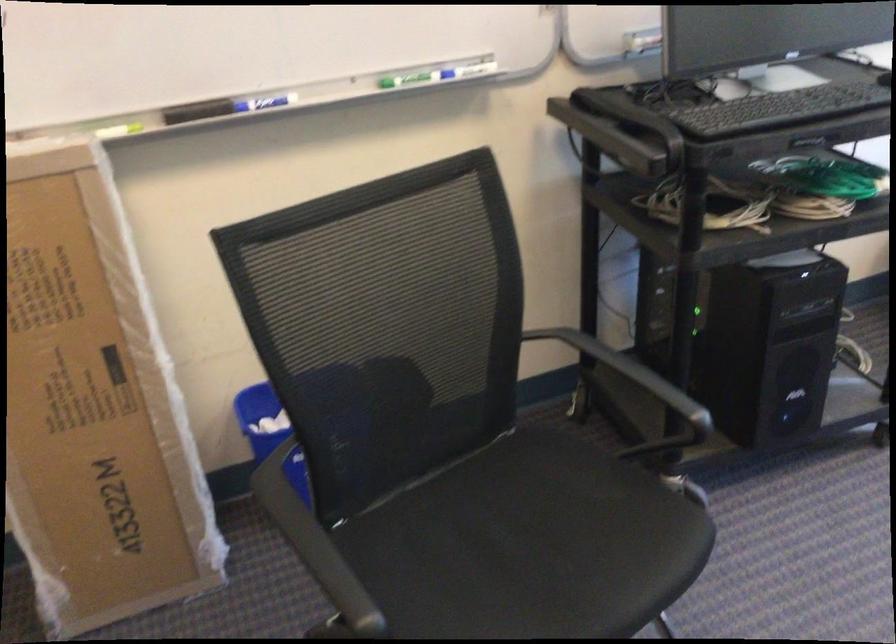
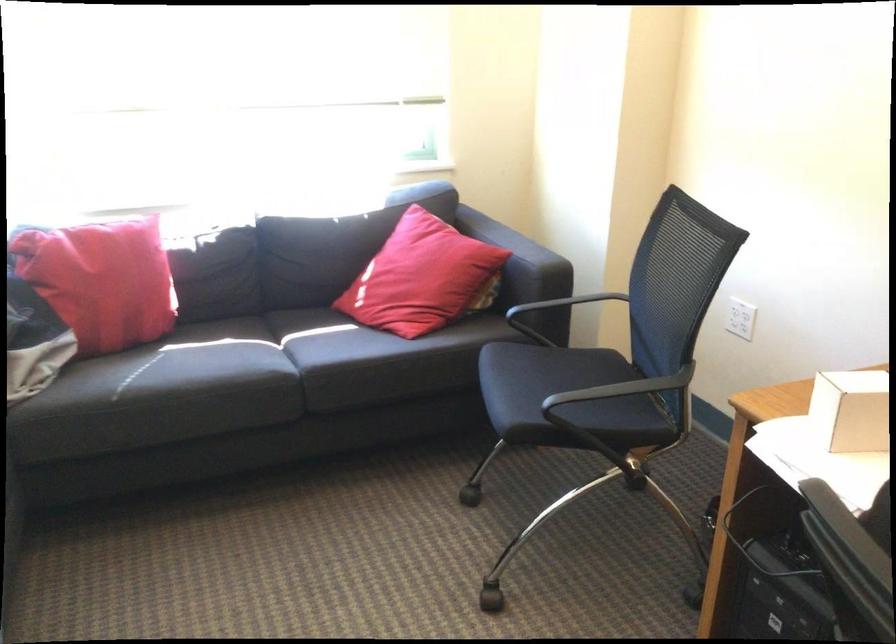
The first image is from the beginning of the video and the second image is from the end. How did the camera likely rotate when shooting the video?

The camera rotated toward right-down.